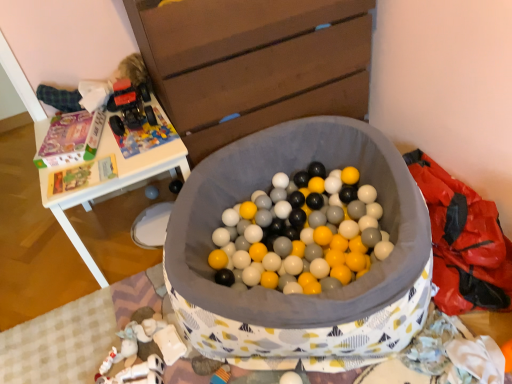
Question: Is wooden chest of drawers at upper center wider or thinner than white plastic table at upper left?

Choices:
 (A) wide
 (B) thin

Answer: (B)

Question: Is wooden chest of drawers at upper center spatially inside white plastic table at upper left, or outside of it?

Choices:
 (A) outside
 (B) inside

Answer: (A)

Question: Considering their positions, is wooden chest of drawers at upper center located in front of or behind white plastic table at upper left?

Choices:
 (A) front
 (B) behind

Answer: (A)

Question: Is white plastic table at upper left spatially inside wooden chest of drawers at upper center, or outside of it?

Choices:
 (A) inside
 (B) outside

Answer: (B)

Question: From a real-world perspective, is white plastic table at upper left physically located above or below wooden chest of drawers at upper center?

Choices:
 (A) above
 (B) below

Answer: (B)

Question: From the image's perspective, is white plastic table at upper left positioned above or below wooden chest of drawers at upper center?

Choices:
 (A) below
 (B) above

Answer: (A)

Question: Based on their positions, is white plastic table at upper left located to the left or right of wooden chest of drawers at upper center?

Choices:
 (A) left
 (B) right

Answer: (A)